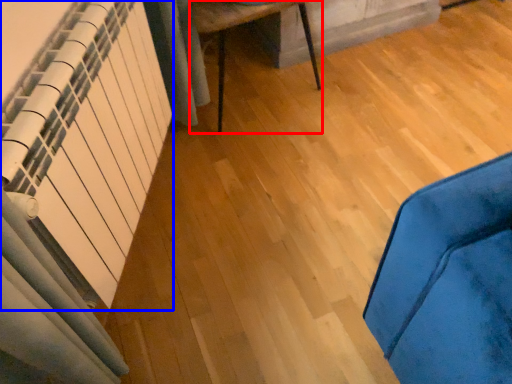
Question: Which point is closer to the camera, furniture (highlighted by a red box) or radiator (highlighted by a blue box)?

Choices:
 (A) furniture
 (B) radiator

Answer: (B)